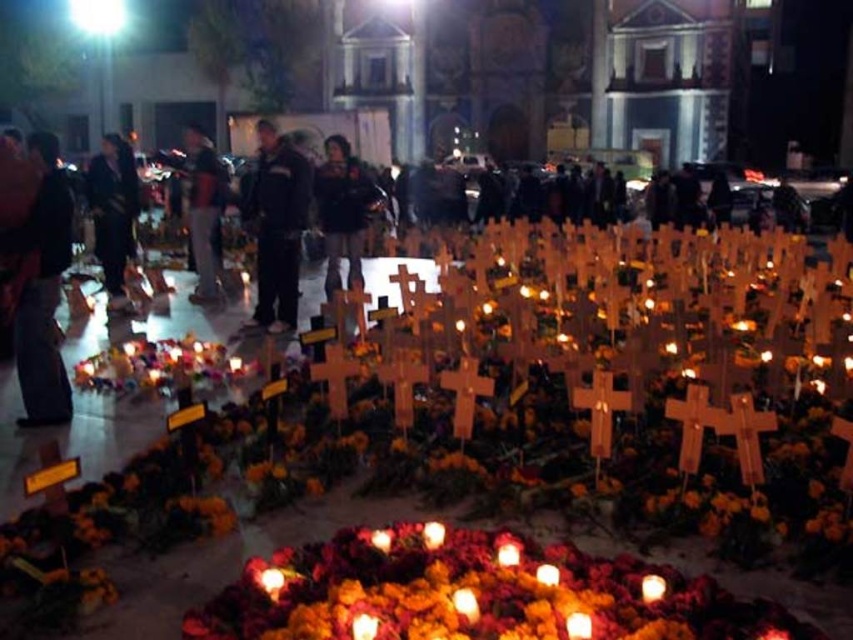
You are a photographer setting up a tripod to take a photo of the memorial display. You notice the black leather jacket at center and the dark blue jacket at left. Which jacket should you position closer to the front of the frame to ensure both are visible without one blocking the other?

To ensure both the black leather jacket at center and the dark blue jacket at left are visible without one blocking the other, position the dark blue jacket at left closer to the front of the frame since the black leather jacket at center is taller and might obscure it if placed behind.

You are standing in front of the memorial display and want to take a photo. You notice two points marked in the scene. Which point, point 1 at coordinates (259,221) or point 2 at (358,166), is closer to you?

Point 1 at coordinates (259,221) is closer to you than point 2 at (358,166) because it is closer to the camera.

You are organizing a charity event and need to decide which jacket to display first. Both the black leather jacket at center and the dark brown leather jacket at center are available. Which jacket has a larger size?

The black leather jacket at center is bigger than the dark brown leather jacket at center, so it has a larger size.